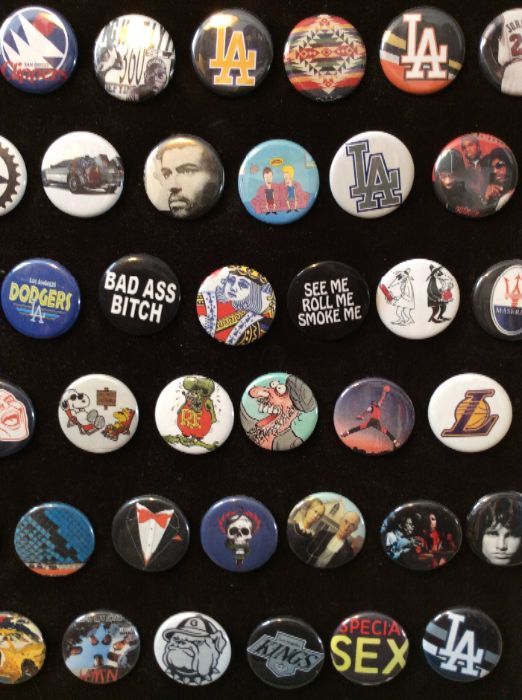
Image resolution: width=522 pixels, height=700 pixels. What are the coordinates of `middle of pink couch` in the screenshot? It's located at tap(278, 199).